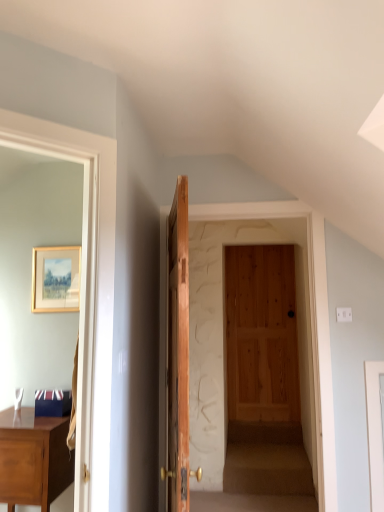
Question: Is wooden picture frame at upper left looking in the opposite direction of matte brown desk at left?

Choices:
 (A) no
 (B) yes

Answer: (A)

Question: Would you say wooden picture frame at upper left contains matte brown desk at left?

Choices:
 (A) no
 (B) yes

Answer: (A)

Question: From a real-world perspective, is wooden picture frame at upper left physically above matte brown desk at left?

Choices:
 (A) no
 (B) yes

Answer: (B)

Question: Considering the relative positions of wooden picture frame at upper left and matte brown desk at left in the image provided, is wooden picture frame at upper left to the right of matte brown desk at left from the viewer's perspective?

Choices:
 (A) no
 (B) yes

Answer: (B)

Question: Is wooden picture frame at upper left positioned beyond the bounds of matte brown desk at left?

Choices:
 (A) yes
 (B) no

Answer: (A)

Question: Looking at the image, does matte brown desk at left seem bigger or smaller compared to wooden door at center?

Choices:
 (A) big
 (B) small

Answer: (B)

Question: From the image's perspective, is matte brown desk at left located above or below wooden door at center?

Choices:
 (A) below
 (B) above

Answer: (A)

Question: Choose the correct answer: Is matte brown desk at left inside wooden door at center or outside it?

Choices:
 (A) outside
 (B) inside

Answer: (A)

Question: Is matte brown desk at left taller or shorter than wooden door at center?

Choices:
 (A) tall
 (B) short

Answer: (B)

Question: Considering the relative positions of wooden door at center and matte brown desk at left in the image provided, is wooden door at center to the left or to the right of matte brown desk at left?

Choices:
 (A) left
 (B) right

Answer: (B)

Question: Considering the positions of wooden door at center and matte brown desk at left in the image, is wooden door at center wider or thinner than matte brown desk at left?

Choices:
 (A) wide
 (B) thin

Answer: (B)

Question: From the image's perspective, is wooden door at center located above or below matte brown desk at left?

Choices:
 (A) below
 (B) above

Answer: (B)

Question: From a real-world perspective, is wooden door at center positioned above or below matte brown desk at left?

Choices:
 (A) below
 (B) above

Answer: (B)

Question: Is point (3, 451) positioned closer to the camera than point (51, 272)?

Choices:
 (A) farther
 (B) closer

Answer: (B)

Question: Based on their positions, is matte brown desk at left located to the left or right of wooden picture frame at upper left?

Choices:
 (A) left
 (B) right

Answer: (A)